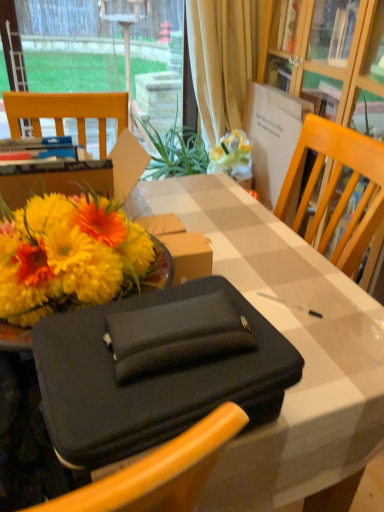
Question: Could you tell me if black fabric briefcase at center is facing beige fabric curtain at upper center?

Choices:
 (A) no
 (B) yes

Answer: (B)

Question: Is black fabric briefcase at center bigger than beige fabric curtain at upper center?

Choices:
 (A) no
 (B) yes

Answer: (B)

Question: Does black fabric briefcase at center have a greater width compared to beige fabric curtain at upper center?

Choices:
 (A) yes
 (B) no

Answer: (A)

Question: Considering the relative positions of black fabric briefcase at center and beige fabric curtain at upper center in the image provided, is black fabric briefcase at center in front of beige fabric curtain at upper center?

Choices:
 (A) yes
 (B) no

Answer: (A)

Question: Is black fabric briefcase at center touching beige fabric curtain at upper center?

Choices:
 (A) no
 (B) yes

Answer: (A)

Question: In terms of size, does black fabric briefcase at center appear bigger or smaller than beige fabric curtain at upper center?

Choices:
 (A) small
 (B) big

Answer: (B)

Question: From a real-world perspective, is black fabric briefcase at center positioned above or below beige fabric curtain at upper center?

Choices:
 (A) below
 (B) above

Answer: (A)

Question: Is black fabric briefcase at center taller or shorter than beige fabric curtain at upper center?

Choices:
 (A) tall
 (B) short

Answer: (B)

Question: Based on their positions, is black fabric briefcase at center located to the left or right of beige fabric curtain at upper center?

Choices:
 (A) left
 (B) right

Answer: (A)

Question: From a real-world perspective, is black fabric briefcase at center positioned above or below transparent glass window at upper left?

Choices:
 (A) below
 (B) above

Answer: (A)

Question: From the image's perspective, relative to transparent glass window at upper left, is black fabric briefcase at center above or below?

Choices:
 (A) above
 (B) below

Answer: (B)

Question: Based on their sizes in the image, would you say black fabric briefcase at center is bigger or smaller than transparent glass window at upper left?

Choices:
 (A) small
 (B) big

Answer: (B)

Question: Is black fabric briefcase at center spatially inside transparent glass window at upper left, or outside of it?

Choices:
 (A) inside
 (B) outside

Answer: (B)

Question: Is point pyautogui.click(x=72, y=8) positioned closer to the camera than point pyautogui.click(x=296, y=250)?

Choices:
 (A) farther
 (B) closer

Answer: (A)

Question: Relative to black fabric briefcase at center, is transparent glass window at upper left in front or behind?

Choices:
 (A) front
 (B) behind

Answer: (B)